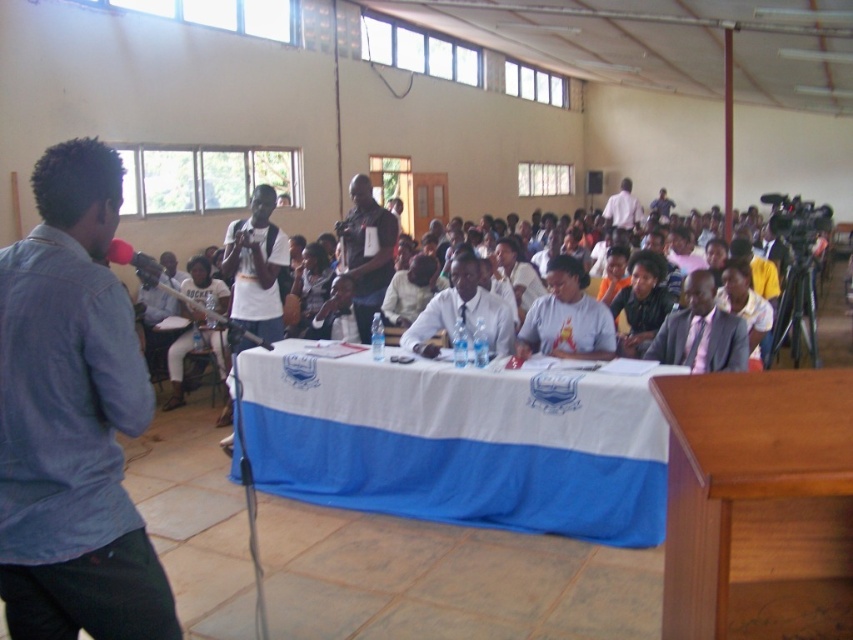
Question: Can you confirm if blue fabric table at center is positioned below wooden podium at lower right?

Choices:
 (A) no
 (B) yes

Answer: (B)

Question: In this image, where is blue fabric table at center located relative to white shirt at center?

Choices:
 (A) below
 (B) above

Answer: (A)

Question: From the image, what is the correct spatial relationship of white matte shirt at center in relation to dark blue shirt at center?

Choices:
 (A) above
 (B) below

Answer: (B)

Question: Among these points, which one is nearest to the camera?

Choices:
 (A) (819, 634)
 (B) (235, 317)
 (C) (355, 177)
 (D) (630, 198)

Answer: (A)

Question: Which of the following is the farthest from the observer?

Choices:
 (A) (622, 216)
 (B) (245, 339)
 (C) (399, 344)

Answer: (A)

Question: Which point is closer to the camera taking this photo?

Choices:
 (A) (572, 531)
 (B) (252, 221)

Answer: (A)